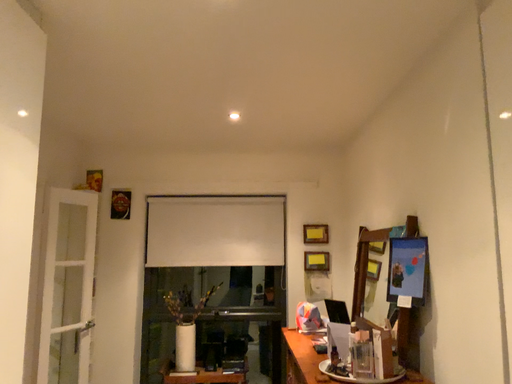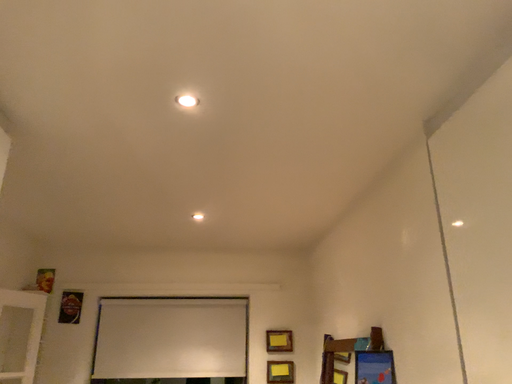
Question: Which way did the camera rotate in the video?

Choices:
 (A) rotated downward
 (B) rotated upward

Answer: (B)